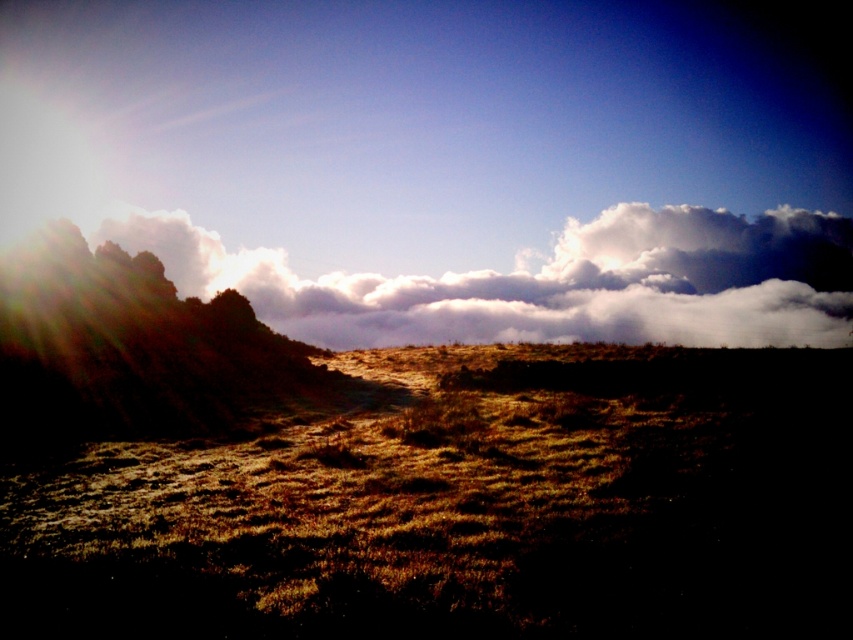
Based on the photo, does brown textured grass at center appear over white fluffy cloud at upper center?

Incorrect, brown textured grass at center is not positioned above white fluffy cloud at upper center.

Does brown textured grass at center lie in front of white fluffy cloud at upper center?

Yes, brown textured grass at center is in front of white fluffy cloud at upper center.

Between point (563, 410) and point (750, 289), which one is positioned in front?

Point (563, 410)

Identify the location of brown textured grass at center. The image size is (853, 640). (467, 508).